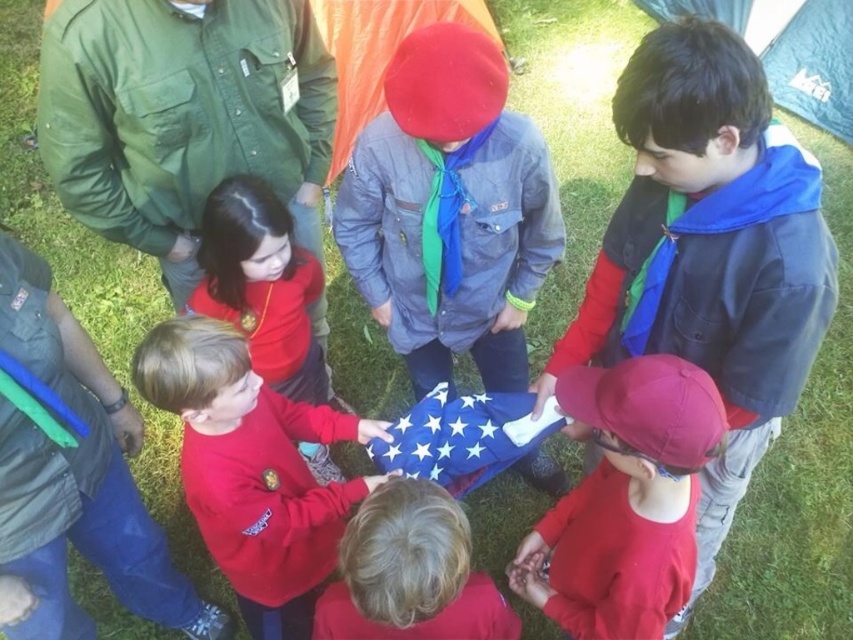
You are a photographer trying to capture a photo of the red matte cap at center and the orange fabric tent at center. Based on their positions, which object should you focus on first if you want to include both in the frame without moving the camera?

The red matte cap at center is positioned on the right side of orange fabric tent at center, so you should focus on the orange fabric tent at center first as it is closer to the center and the red matte cap at center is to its right.